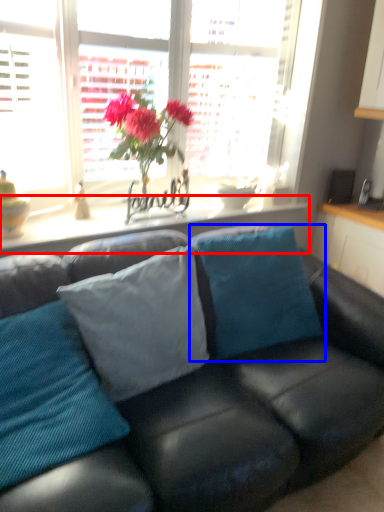
Question: Which of the following is the closest to the observer, window sill (highlighted by a red box) or pillow (highlighted by a blue box)?

Choices:
 (A) window sill
 (B) pillow

Answer: (B)